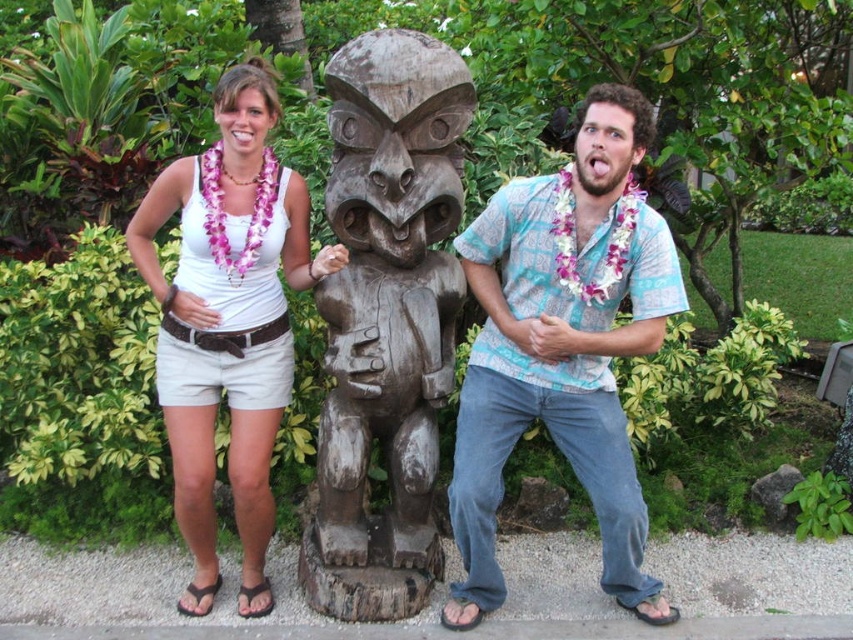
You are standing in a tropical garden and see the wooden statue at center. If you want to take a photo of it from a distance of 10 feet, will you need to move closer or farther away?

The wooden statue at center is currently 10.20 feet away from you. Since you want to be at 10 feet, you need to move slightly closer to reduce the distance by 0.20 feet.

In the scene shown: You are standing in the tropical garden scene and want to locate the exact point at coordinates (386, 320). According to the image, where is this point located?

The point at coordinates (386, 320) is on the wooden carving at center.

You are planning to take a photo of the wooden carving at center and the matte blue shirt at center. Which object should you focus on first if you want to capture both in a single frame without moving the camera, considering their sizes?

The wooden carving at center is bigger than the matte blue shirt at center, so you should focus on the wooden carving at center first to ensure it fits properly in the frame before adjusting for the smaller matte blue shirt at center.